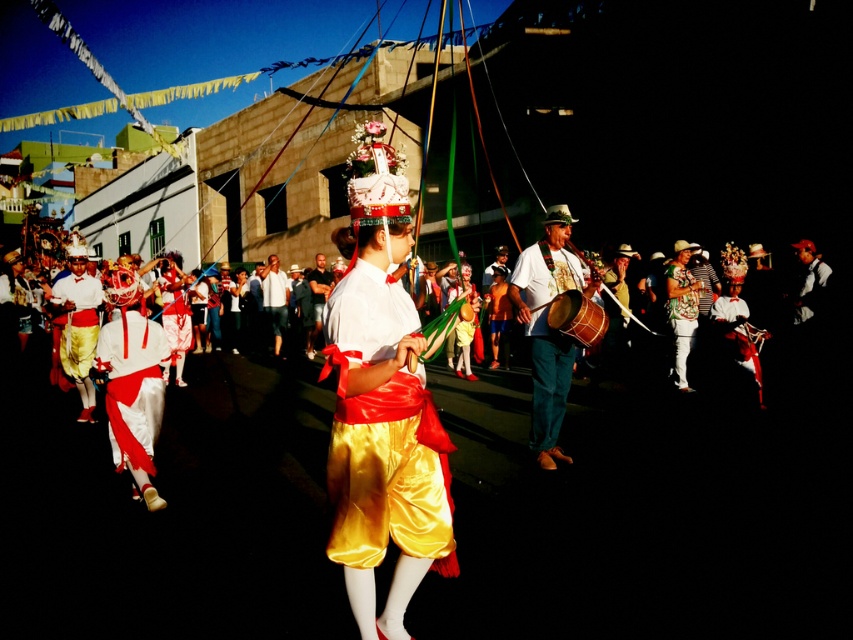
Image resolution: width=853 pixels, height=640 pixels. What do you see at coordinates (381, 436) in the screenshot? I see `shiny gold shorts at center` at bounding box center [381, 436].

In the scene shown: Is shiny gold shorts at center positioned in front of wooden drum at center?

Yes, it is in front of wooden drum at center.

Is point (358, 276) less distant than point (564, 314)?

Yes.

Where is `shiny gold shorts at center`? The height and width of the screenshot is (640, 853). shiny gold shorts at center is located at coordinates (381, 436).

Is shiny green fabric at center closer to the viewer compared to wooden drum at center?

No, it is not.

Is point (676, 332) closer to viewer compared to point (596, 317)?

That is False.

This screenshot has width=853, height=640. What do you see at coordinates (682, 308) in the screenshot?
I see `shiny green fabric at center` at bounding box center [682, 308].

Where is `shiny green fabric at center`? shiny green fabric at center is located at coordinates (682, 308).

Which of these two, shiny green fabric at center or white satin shorts at center, stands shorter?

Standing shorter between the two is white satin shorts at center.

Identify the location of shiny green fabric at center. (682, 308).